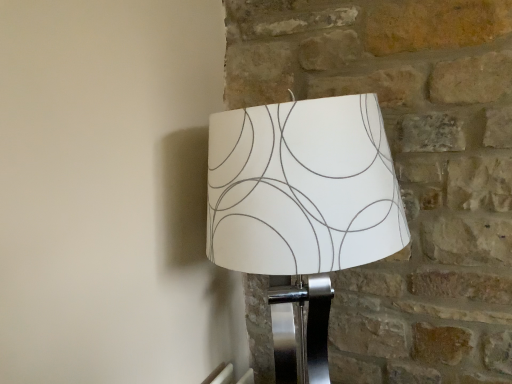
Where is `white paper lampshade at upper right`? This screenshot has height=384, width=512. white paper lampshade at upper right is located at coordinates (303, 205).

What is the approximate height of white paper lampshade at upper right?

It is 33.97 inches.

Measure the distance between white paper lampshade at upper right and camera.

The depth of white paper lampshade at upper right is 28.90 inches.

The image size is (512, 384). What do you see at coordinates (303, 205) in the screenshot?
I see `white paper lampshade at upper right` at bounding box center [303, 205].

At what (x,y) coordinates should I click in order to perform the action: click on white paper lampshade at upper right. Please return your answer as a coordinate pair (x, y). This screenshot has width=512, height=384. Looking at the image, I should click on (303, 205).